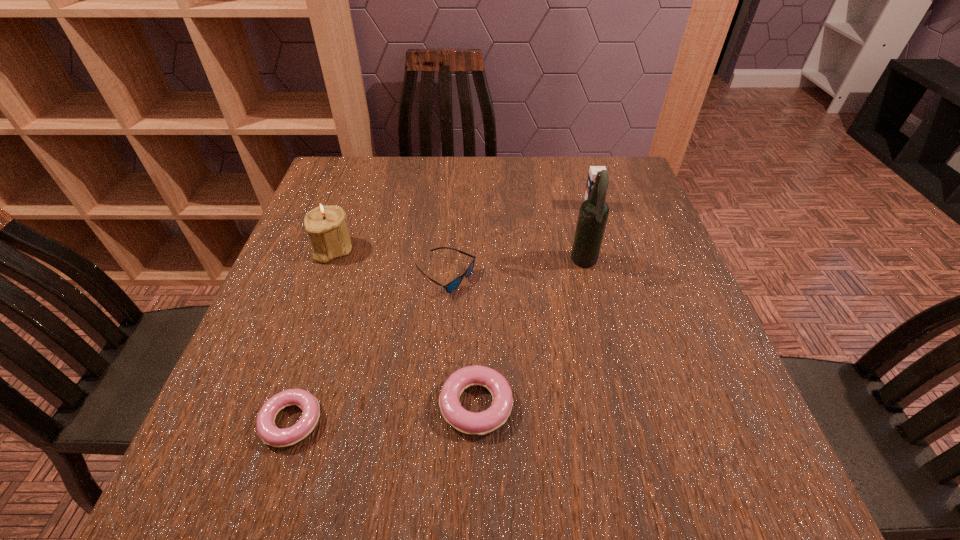
Find the location of a particular element. This screenshot has width=960, height=540. vacant space that satisfies the following two spatial constraints: 1. on the front side of the right doughnut; 2. on the right side of the candle_holder is located at coordinates (277, 405).